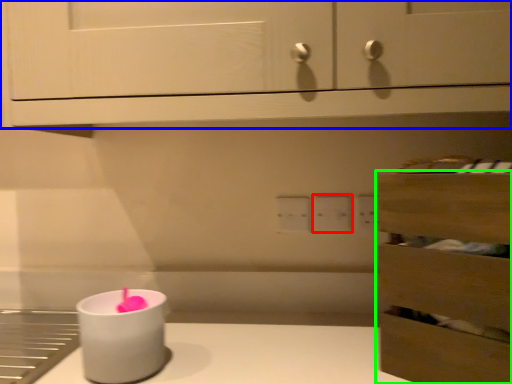
Question: Estimate the real-world distances between objects in this image. Which object is closer to electric outlet (highlighted by a red box), cabinetry (highlighted by a blue box) or drawer (highlighted by a green box)?

Choices:
 (A) cabinetry
 (B) drawer

Answer: (B)